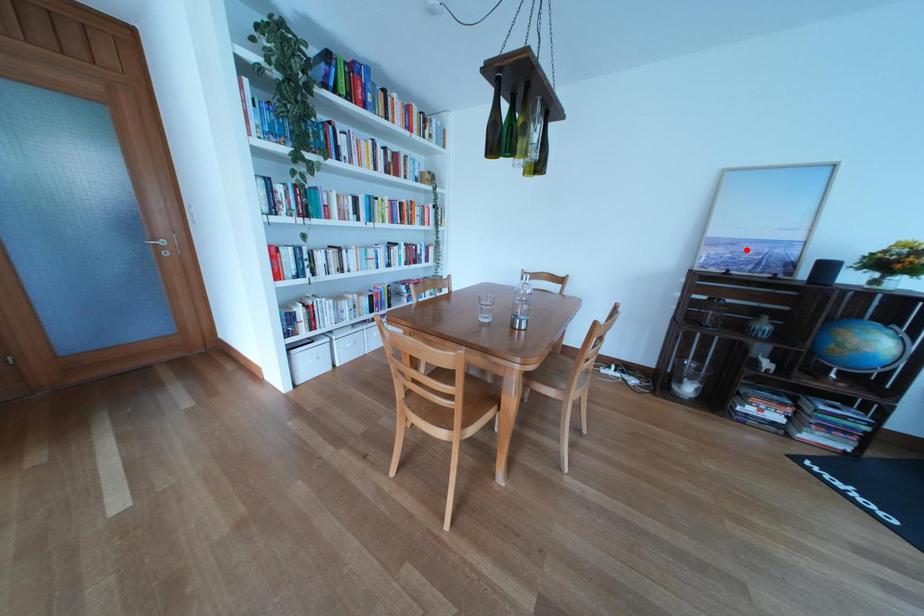
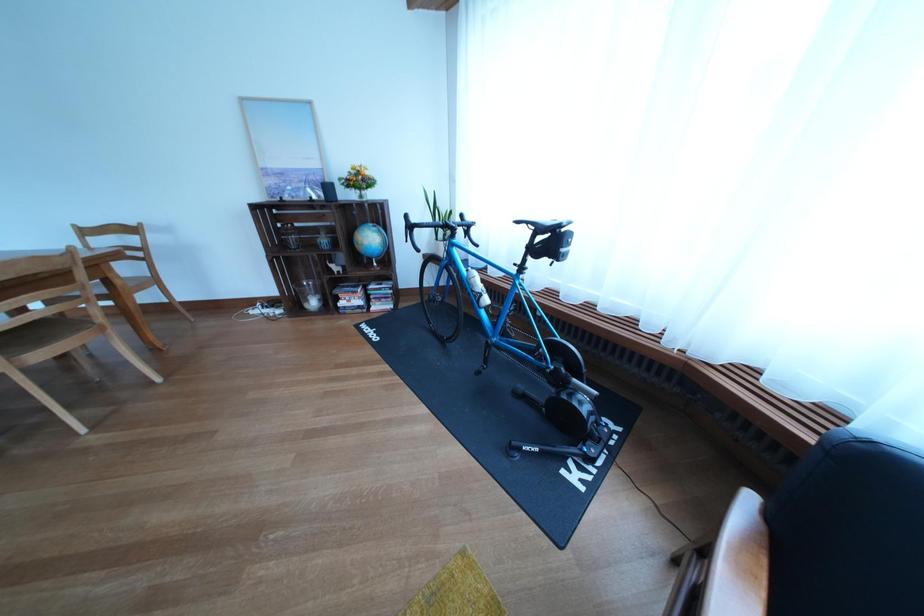
Question: I am providing you with two images of the same scene from different viewpoints. In image1, a red point is highlighted. Considering the same 3D point in image2, which of the following is correct?

Choices:
 (A) It is closer
 (B) It is farther

Answer: (A)